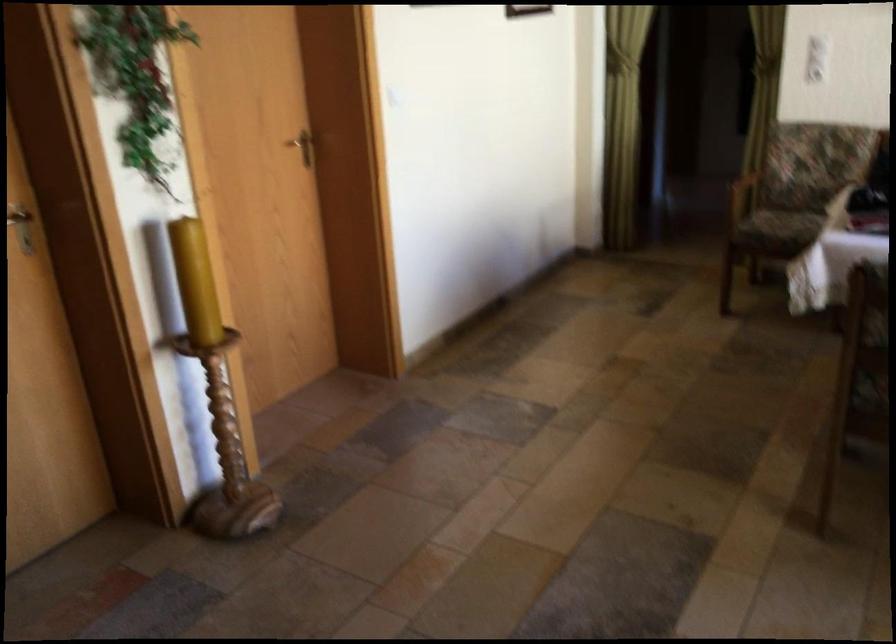
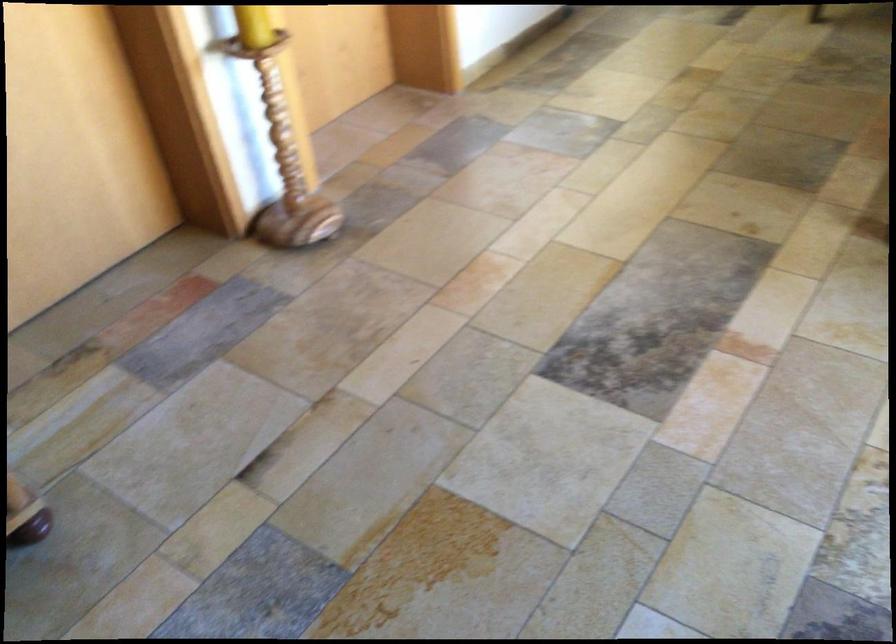
The point at (227, 450) is marked in the first image. Where is the corresponding point in the second image?

(283, 162)